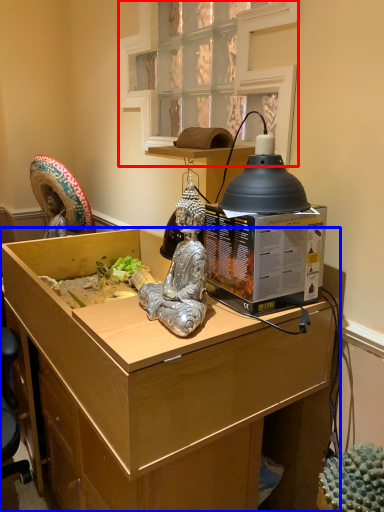
Question: Which of the following is the farthest to the observer, window (highlighted by a red box) or desk (highlighted by a blue box)?

Choices:
 (A) window
 (B) desk

Answer: (A)